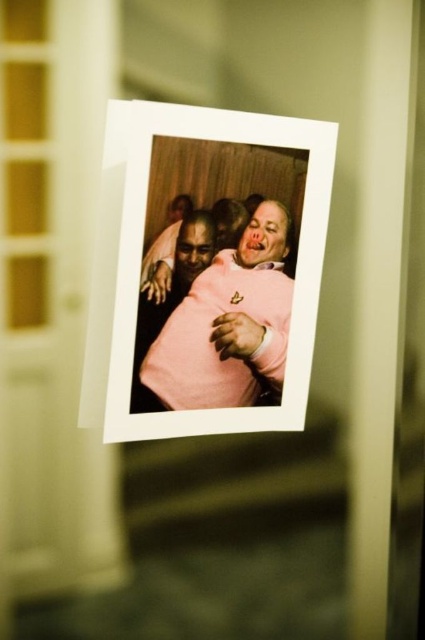
Question: Is white paper at center in front of pink matte sweater at center?

Choices:
 (A) no
 (B) yes

Answer: (B)

Question: Can you confirm if white paper at center is wider than pink matte sweater at center?

Choices:
 (A) yes
 (B) no

Answer: (A)

Question: Among these points, which one is farthest from the camera?

Choices:
 (A) (240, 280)
 (B) (317, 250)

Answer: (B)

Question: Is white paper at center smaller than pink matte sweater at center?

Choices:
 (A) no
 (B) yes

Answer: (A)